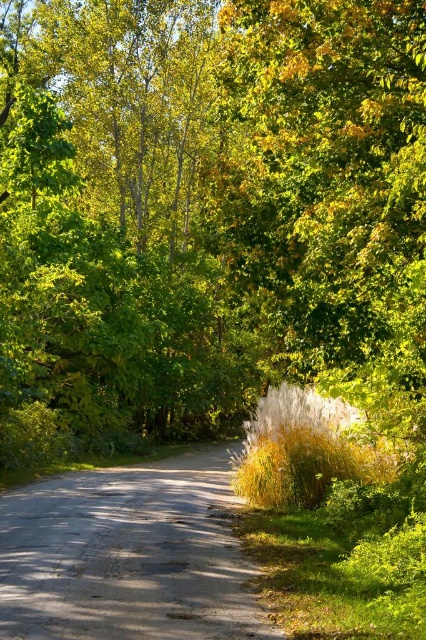
Which is behind, point (167, 330) or point (135, 573)?

The point (167, 330) is more distant.

Is point (60, 12) in front of point (213, 490)?

No.

Find the location of a particular element. This screenshot has height=640, width=426. green leafy tree at center is located at coordinates (207, 212).